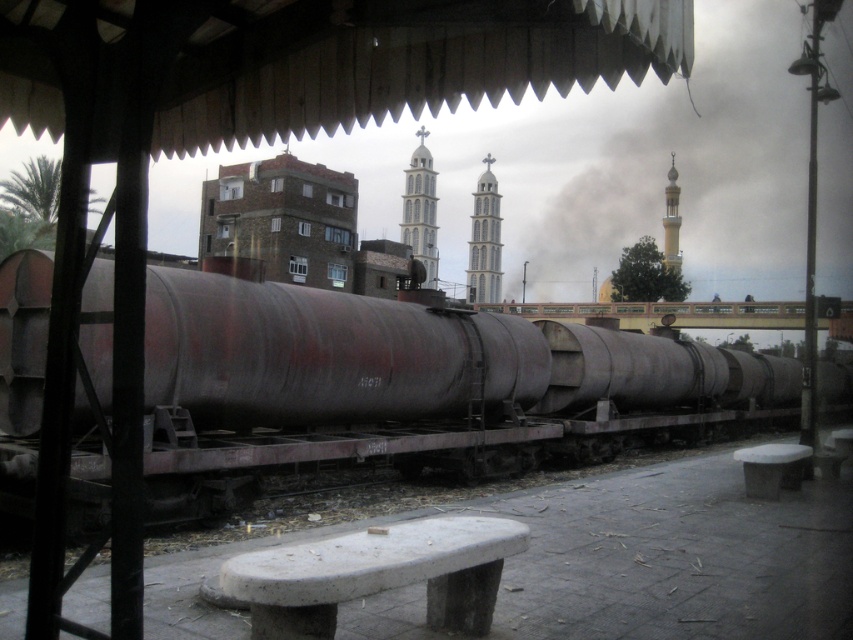
Is point (485, 232) farther from camera compared to point (672, 248)?

Yes, point (485, 232) is farther from viewer.

Describe the element at coordinates (485, 241) in the screenshot. Image resolution: width=853 pixels, height=640 pixels. I see `white glass tower at center` at that location.

Find the location of a particular element. The image size is (853, 640). white glass tower at center is located at coordinates (485, 241).

Who is more distant from viewer, (x=196, y=404) or (x=490, y=289)?

Positioned behind is point (x=490, y=289).

Does point (180, 387) lie behind point (485, 282)?

No, (180, 387) is in front of (485, 282).

Which is behind, point (695, 360) or point (486, 268)?

Positioned behind is point (486, 268).

The image size is (853, 640). I want to click on rusty metal train car at center, so click(x=390, y=372).

Who is more forward, (x=160, y=458) or (x=665, y=195)?

Point (x=160, y=458) is in front.

You are a GUI agent. You are given a task and a screenshot of the screen. Output one action in this format:
    pyautogui.click(x=<x>, y=<y>)
    Task: Click on the rusty metal train car at center
    
    Given the screenshot: What is the action you would take?
    [x=390, y=372]

Which is behind, point (741, 371) or point (670, 198)?

The point (670, 198) is behind.

Identify the location of rusty metal train car at center. (390, 372).